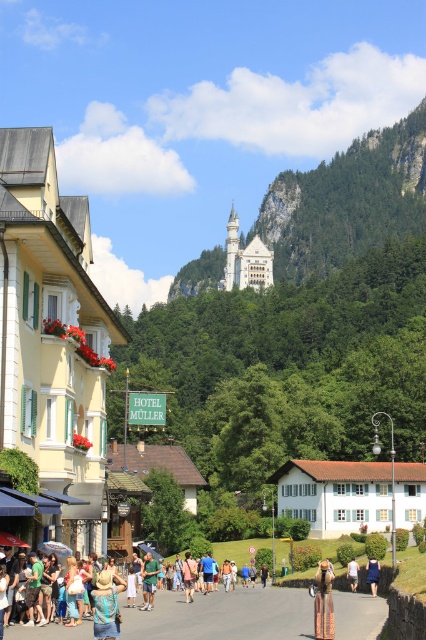
Who is more forward, (x=143, y=582) or (x=351, y=573)?

Point (x=143, y=582) is more forward.

Can you confirm if green fabric shirt at center is bigger than light blue denim shorts at center?

Yes.

Is point (149, 552) in front of point (354, 589)?

Yes, it is in front of point (354, 589).

Identify the location of green fabric shirt at center. This screenshot has height=640, width=426. (149, 580).

Is point (301, 259) more distant than point (374, 579)?

That is True.

Between green forested mountain at upper center and blue dress at center, which one appears on the right side from the viewer's perspective?

Positioned to the right is green forested mountain at upper center.

What do you see at coordinates (347, 202) in the screenshot? I see `green forested mountain at upper center` at bounding box center [347, 202].

Locate an element on the screen. The height and width of the screenshot is (640, 426). green forested mountain at upper center is located at coordinates (347, 202).

Locate an element on the screen. The height and width of the screenshot is (640, 426). tan leather jacket at center is located at coordinates (324, 604).

Does tan leather jacket at center appear on the right side of blue dress at center?

No, tan leather jacket at center is not to the right of blue dress at center.

Measure the distance between tan leather jacket at center and camera.

34.22 meters

Identify the location of tan leather jacket at center. The width and height of the screenshot is (426, 640). (324, 604).